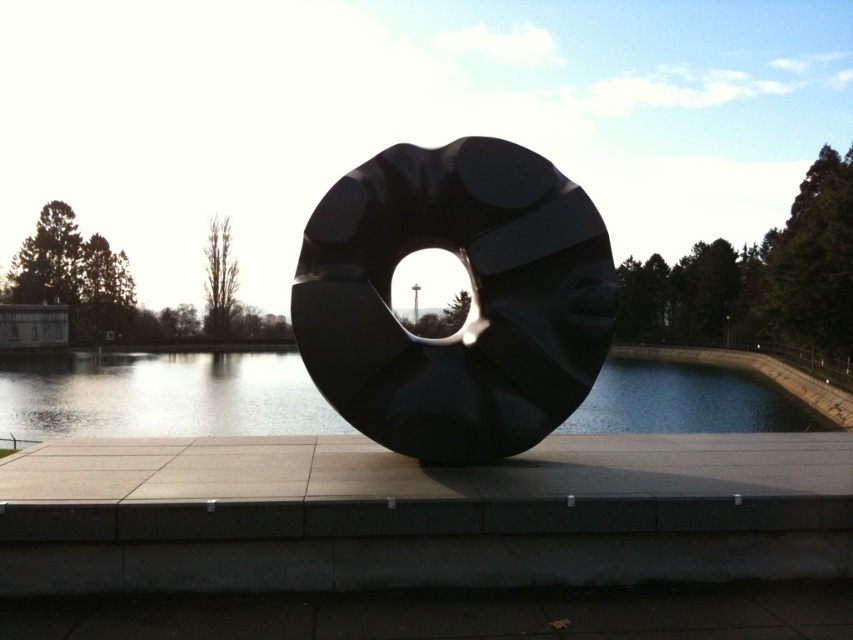
Question: Is the position of glossy black donut at center less distant than that of transparent glass water at center?

Choices:
 (A) yes
 (B) no

Answer: (A)

Question: Which point is farther from the camera taking this photo?

Choices:
 (A) (161, 420)
 (B) (328, 372)

Answer: (A)

Question: Can you confirm if glossy black donut at center is wider than transparent glass water at center?

Choices:
 (A) yes
 (B) no

Answer: (B)

Question: Is glossy black donut at center above transparent glass water at center?

Choices:
 (A) no
 (B) yes

Answer: (B)

Question: Which of the following is the closest to the observer?

Choices:
 (A) [537, 202]
 (B) [804, 417]

Answer: (A)